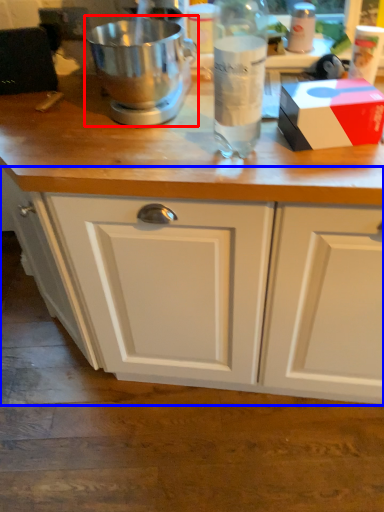
Question: Which point is further to the camera, mixer (highlighted by a red box) or cabinetry (highlighted by a blue box)?

Choices:
 (A) mixer
 (B) cabinetry

Answer: (B)